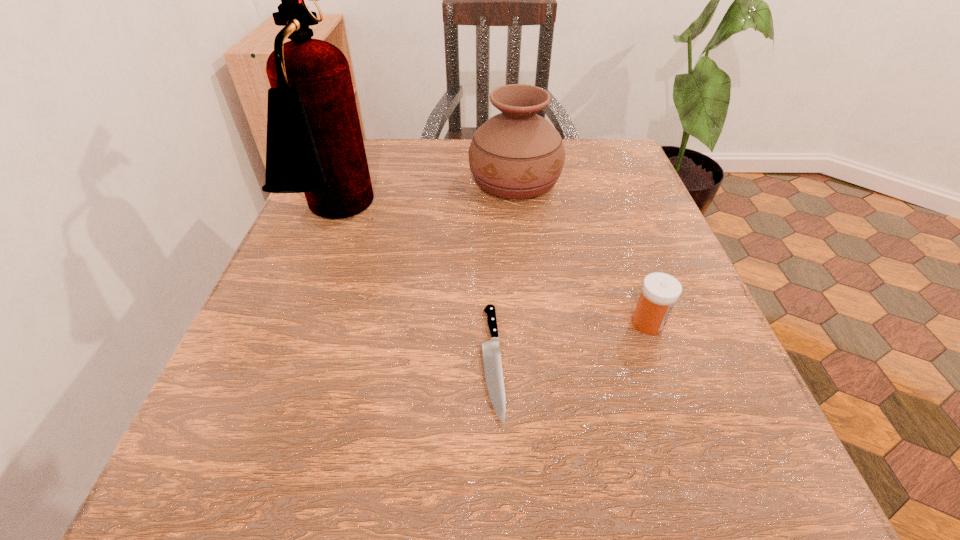
Find the location of `fire extinguisher positioned at the far edge`. fire extinguisher positioned at the far edge is located at coordinates (314, 145).

Locate an element on the screen. urn that is at the far edge is located at coordinates (517, 154).

This screenshot has height=540, width=960. What are the coordinates of `object present at the left edge` in the screenshot? It's located at (314, 145).

The height and width of the screenshot is (540, 960). Identify the location of object located in the right edge section of the desktop. (660, 291).

Locate an element on the screen. The height and width of the screenshot is (540, 960). object that is at the far left corner is located at coordinates (314, 145).

Identify the location of vacant space at the far edge of the desktop. (462, 143).

You are a GUI agent. You are given a task and a screenshot of the screen. Output one action in this format:
    pyautogui.click(x=<x>, y=<y>)
    Task: Click on the vacant space at the near edge of the desktop
    The image size is (960, 540).
    Given the screenshot: What is the action you would take?
    pyautogui.click(x=361, y=512)

In the image, there is a desktop. Where is `free region at the left edge`? This screenshot has width=960, height=540. free region at the left edge is located at coordinates (319, 309).

Where is `vacant space at the right edge of the desktop`? Image resolution: width=960 pixels, height=540 pixels. vacant space at the right edge of the desktop is located at coordinates (616, 249).

Find the location of `vacant region at the far left corner of the desktop`. vacant region at the far left corner of the desktop is located at coordinates click(x=373, y=161).